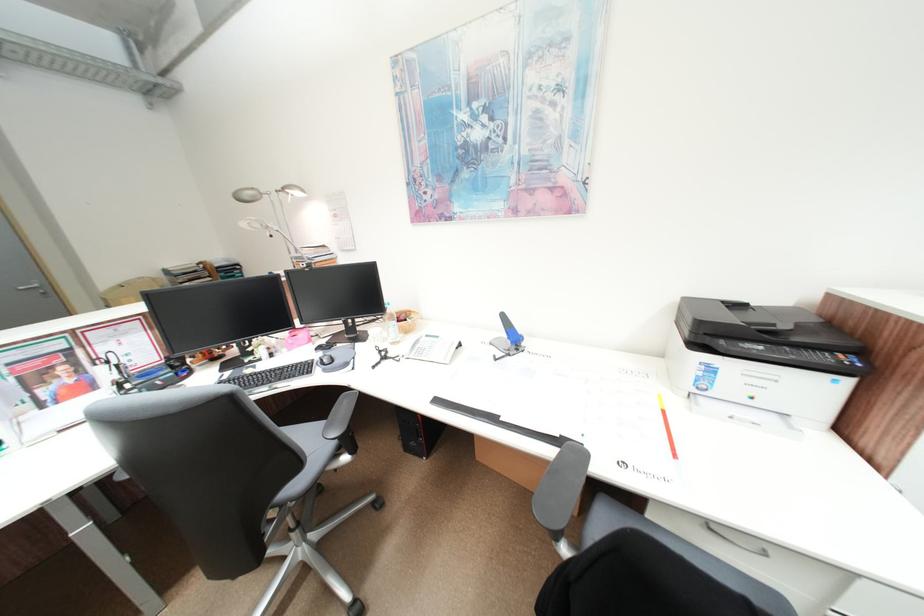
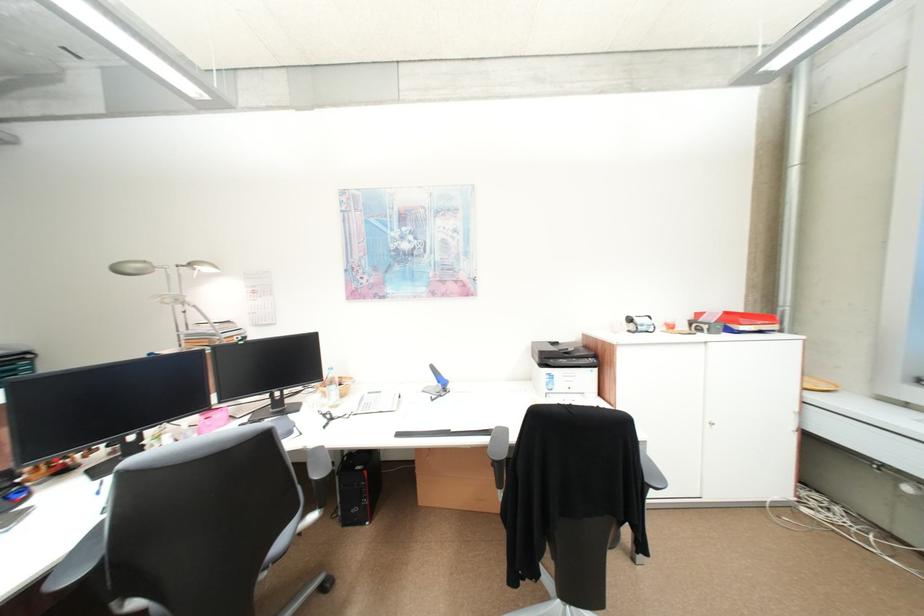
Find the pixel in the second image that matches point (394, 339) in the first image.

(332, 406)